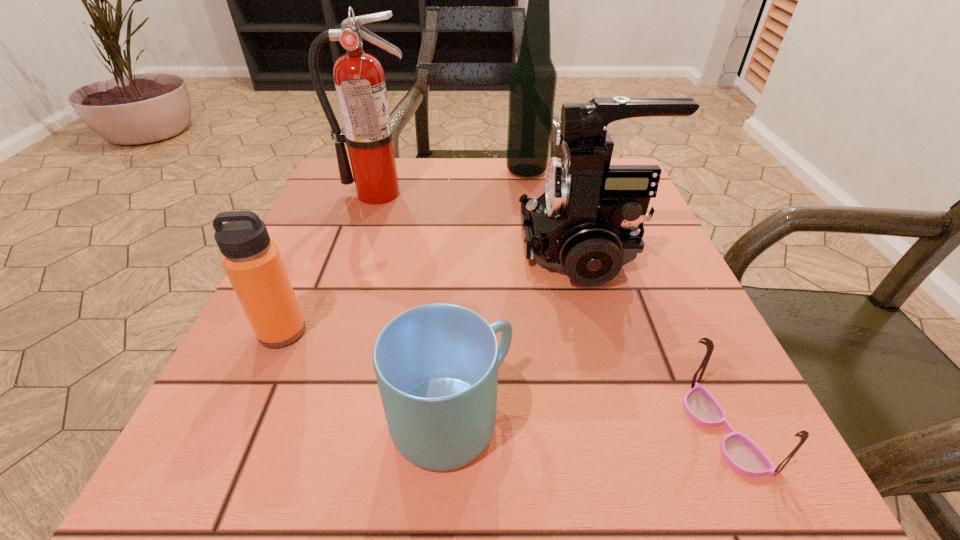
The image size is (960, 540). I want to click on free location at the right edge, so click(648, 404).

The width and height of the screenshot is (960, 540). In order to click on vacant space at the near left corner in this screenshot , I will do `click(284, 456)`.

In the image, there is a desktop. Where is `free region at the far right corner`? free region at the far right corner is located at coordinates (560, 159).

The height and width of the screenshot is (540, 960). In order to click on blank region between the farthest object and the spectacles in this screenshot , I will do `click(625, 301)`.

This screenshot has width=960, height=540. In order to click on blank region between the mug and the shortest object in this screenshot , I will do `click(588, 425)`.

I want to click on vacant area between the spectacles and the fourth shortest object, so click(654, 341).

Image resolution: width=960 pixels, height=540 pixels. What are the coordinates of `vacant area that lies between the spectacles and the third nearest object` in the screenshot? It's located at (503, 381).

Locate an element on the screen. free space between the farthest object and the second farthest object is located at coordinates (452, 183).

Locate an element on the screen. This screenshot has height=540, width=960. vacant space that is in between the farthest object and the thermos bottle is located at coordinates (404, 252).

At what (x,y) coordinates should I click in order to perform the action: click on free space between the third object from left to right and the thermos bottle. Please return your answer as a coordinate pair (x, y). This screenshot has width=960, height=540. Looking at the image, I should click on 367,376.